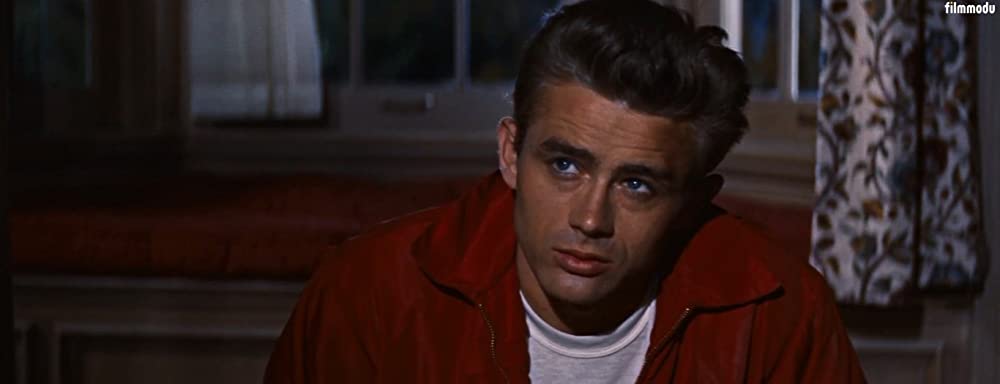
This screenshot has width=1000, height=384. In order to click on door in this screenshot , I will do click(424, 67).